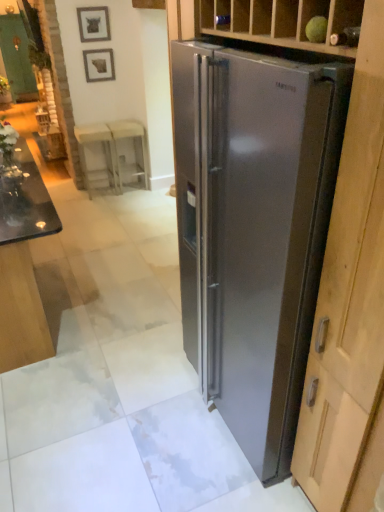
Question: Is metallic silver picture frame at upper center, which is the 1th picture frame from top to bottom, wider than stainless steel refrigerator at right?

Choices:
 (A) no
 (B) yes

Answer: (A)

Question: Are metallic silver picture frame at upper center, the second picture frame positioned from the bottom, and stainless steel refrigerator at right beside each other?

Choices:
 (A) yes
 (B) no

Answer: (B)

Question: Is metallic silver picture frame at upper center, the second picture frame positioned from the bottom, taller than stainless steel refrigerator at right?

Choices:
 (A) no
 (B) yes

Answer: (A)

Question: Is metallic silver picture frame at upper center, the second picture frame positioned from the bottom, not within stainless steel refrigerator at right?

Choices:
 (A) yes
 (B) no

Answer: (A)

Question: Is metallic silver picture frame at upper center, the second picture frame positioned from the bottom, closer to the viewer compared to stainless steel refrigerator at right?

Choices:
 (A) no
 (B) yes

Answer: (A)

Question: From a real-world perspective, is white plastic stool at center, placed as the 2th stool when sorted from left to right, physically located above or below black glass table at lower left?

Choices:
 (A) above
 (B) below

Answer: (B)

Question: Considering the positions of white plastic stool at center, which is counted as the first stool, starting from the right, and black glass table at lower left in the image, is white plastic stool at center, which is counted as the first stool, starting from the right, bigger or smaller than black glass table at lower left?

Choices:
 (A) big
 (B) small

Answer: (B)

Question: Is white plastic stool at center, which is counted as the first stool, starting from the right, inside the boundaries of black glass table at lower left, or outside?

Choices:
 (A) inside
 (B) outside

Answer: (B)

Question: Would you say white plastic stool at center, which is counted as the first stool, starting from the right, is to the left or to the right of black glass table at lower left in the picture?

Choices:
 (A) left
 (B) right

Answer: (B)

Question: Considering the positions of green matte glass door at upper left and white plastic stool at center, marked as the second stool in a right-to-left arrangement, in the image, is green matte glass door at upper left bigger or smaller than white plastic stool at center, marked as the second stool in a right-to-left arrangement,?

Choices:
 (A) big
 (B) small

Answer: (A)

Question: In the image, is green matte glass door at upper left positioned in front of or behind white plastic stool at center, marked as the second stool in a right-to-left arrangement?

Choices:
 (A) behind
 (B) front

Answer: (A)

Question: Is point (14, 73) positioned closer to the camera than point (104, 138)?

Choices:
 (A) closer
 (B) farther

Answer: (B)

Question: Is green matte glass door at upper left to the left or to the right of white plastic stool at center, the 1th stool when ordered from left to right, in the image?

Choices:
 (A) right
 (B) left

Answer: (B)

Question: Visually, is green matte glass door at upper left positioned to the left or to the right of black glass table at lower left?

Choices:
 (A) right
 (B) left

Answer: (B)

Question: Do you think green matte glass door at upper left is within black glass table at lower left, or outside of it?

Choices:
 (A) outside
 (B) inside

Answer: (A)